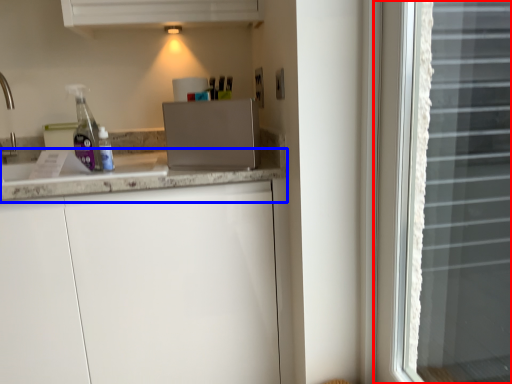
Question: Which object appears farthest to the camera in this image, window (highlighted by a red box) or countertop (highlighted by a blue box)?

Choices:
 (A) window
 (B) countertop

Answer: (B)